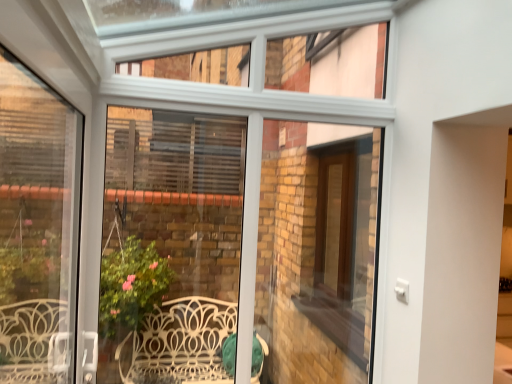
Question: Is white plastic window frame at left inside or outside of brown wooden screen door at center?

Choices:
 (A) outside
 (B) inside

Answer: (A)

Question: From a real-world perspective, relative to brown wooden screen door at center, is white plastic window frame at left vertically above or below?

Choices:
 (A) below
 (B) above

Answer: (A)

Question: Would you say white plastic window frame at left is to the left or to the right of brown wooden screen door at center in the picture?

Choices:
 (A) right
 (B) left

Answer: (B)

Question: In terms of height, does brown wooden screen door at center look taller or shorter compared to white plastic window frame at left?

Choices:
 (A) short
 (B) tall

Answer: (A)

Question: Is brown wooden screen door at center to the left or to the right of white plastic window frame at left in the image?

Choices:
 (A) left
 (B) right

Answer: (B)

Question: In terms of size, does brown wooden screen door at center appear bigger or smaller than white plastic window frame at left?

Choices:
 (A) small
 (B) big

Answer: (A)

Question: Is point (326, 185) positioned closer to the camera than point (25, 172)?

Choices:
 (A) closer
 (B) farther

Answer: (B)